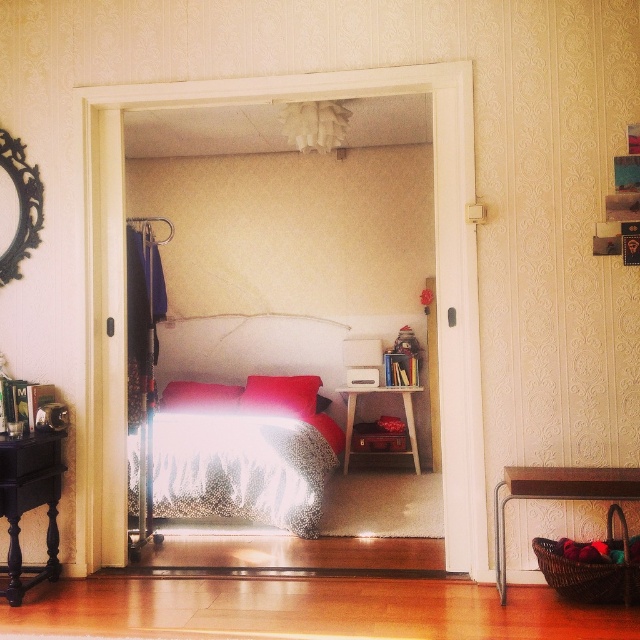
Question: Which object is the farthest from the woven wicker basket at lower right?

Choices:
 (A) black ornate mirror at upper left
 (B) patterned fabric bed at center
 (C) velvet red pillow at center
 (D) red velvet pillow at center

Answer: (D)

Question: Can you confirm if patterned fabric bed at center is positioned to the left of red velvet pillow at center?

Choices:
 (A) no
 (B) yes

Answer: (A)

Question: Estimate the real-world distances between objects in this image. Which object is closer to the red velvet pillow at center?

Choices:
 (A) black ornate mirror at upper left
 (B) patterned fabric bed at center
 (C) velvet red pillow at center

Answer: (B)

Question: Among these objects, which one is nearest to the camera?

Choices:
 (A) patterned fabric bed at center
 (B) velvet red pillow at center

Answer: (A)

Question: Does woven wicker basket at lower right appear under red velvet pillow at center?

Choices:
 (A) no
 (B) yes

Answer: (B)

Question: Observing the image, what is the correct spatial positioning of patterned fabric bed at center in reference to woven wicker basket at lower right?

Choices:
 (A) right
 (B) left

Answer: (B)